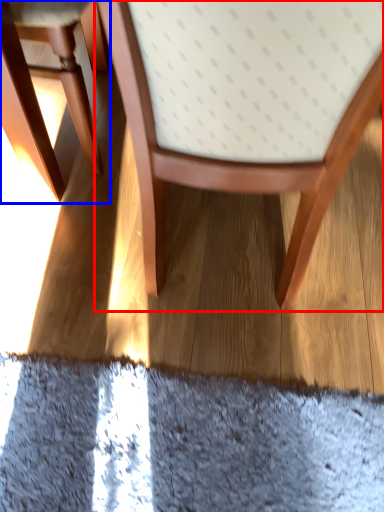
Question: Which of the following is the closest to the observer, chair (highlighted by a red box) or chair (highlighted by a blue box)?

Choices:
 (A) chair
 (B) chair

Answer: (A)